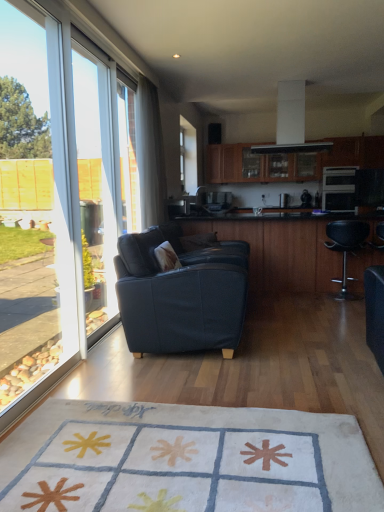
Question: Is transparent glass window screen at left at the back of dark blue fabric couch at center?

Choices:
 (A) yes
 (B) no

Answer: (B)

Question: From the image's perspective, does dark blue fabric couch at center appear lower than transparent glass window screen at left?

Choices:
 (A) yes
 (B) no

Answer: (A)

Question: Can transparent glass window screen at left be found inside dark blue fabric couch at center?

Choices:
 (A) yes
 (B) no

Answer: (B)

Question: Can you confirm if dark blue fabric couch at center is bigger than transparent glass window screen at left?

Choices:
 (A) no
 (B) yes

Answer: (B)

Question: Is the surface of dark blue fabric couch at center in direct contact with transparent glass window screen at left?

Choices:
 (A) no
 (B) yes

Answer: (A)

Question: From a real-world perspective, is dark blue fabric couch at center beneath transparent glass window screen at left?

Choices:
 (A) yes
 (B) no

Answer: (A)

Question: From the image's perspective, does wooden cabinet at upper center appear lower than dark blue fabric couch at center?

Choices:
 (A) no
 (B) yes

Answer: (A)

Question: Is wooden cabinet at upper center positioned far away from dark blue fabric couch at center?

Choices:
 (A) no
 (B) yes

Answer: (B)

Question: Can you confirm if wooden cabinet at upper center is bigger than dark blue fabric couch at center?

Choices:
 (A) no
 (B) yes

Answer: (A)

Question: Is wooden cabinet at upper center oriented away from dark blue fabric couch at center?

Choices:
 (A) no
 (B) yes

Answer: (A)

Question: Is wooden cabinet at upper center oriented towards dark blue fabric couch at center?

Choices:
 (A) no
 (B) yes

Answer: (B)

Question: Can you confirm if wooden cabinet at upper center is taller than dark blue fabric couch at center?

Choices:
 (A) yes
 (B) no

Answer: (B)

Question: Does matte black oven at right have a lesser height compared to transparent glass window screen at left?

Choices:
 (A) yes
 (B) no

Answer: (A)